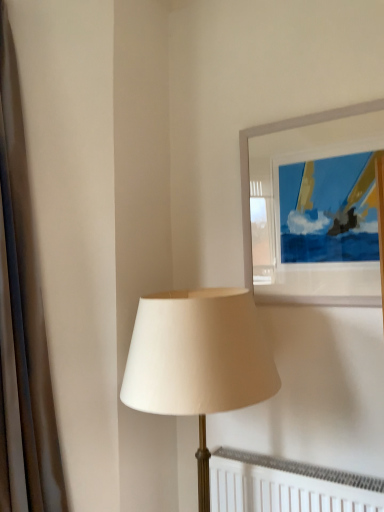
Describe the element at coordinates (276, 132) in the screenshot. The width and height of the screenshot is (384, 512). I see `white glossy frame at upper right` at that location.

You are a GUI agent. You are given a task and a screenshot of the screen. Output one action in this format:
    pyautogui.click(x=<x>, y=<y>)
    Task: Click on the white glossy frame at upper right
    This screenshot has height=512, width=384.
    Given the screenshot: What is the action you would take?
    pyautogui.click(x=276, y=132)

Find the location of a particular element. The image size is (384, 512). white glossy frame at upper right is located at coordinates (276, 132).